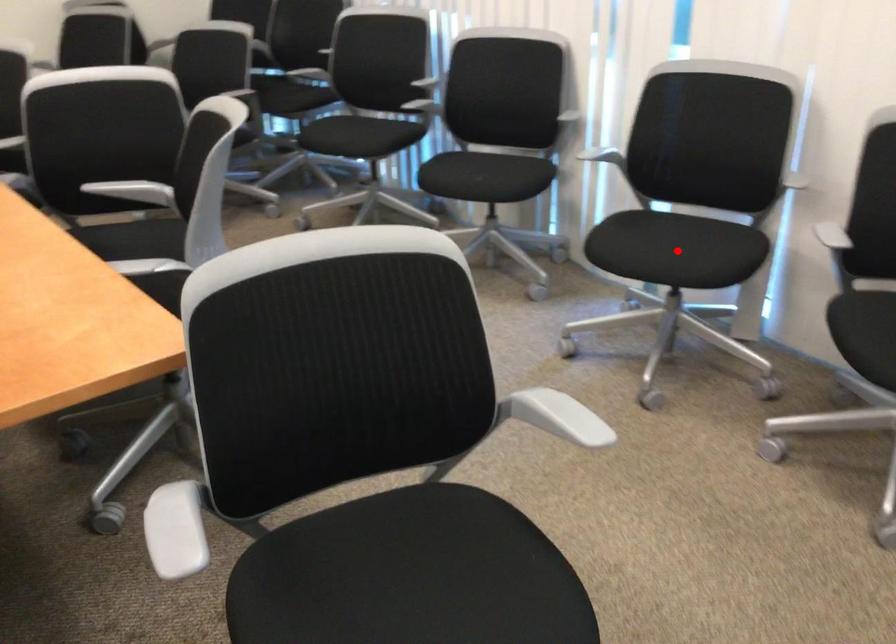
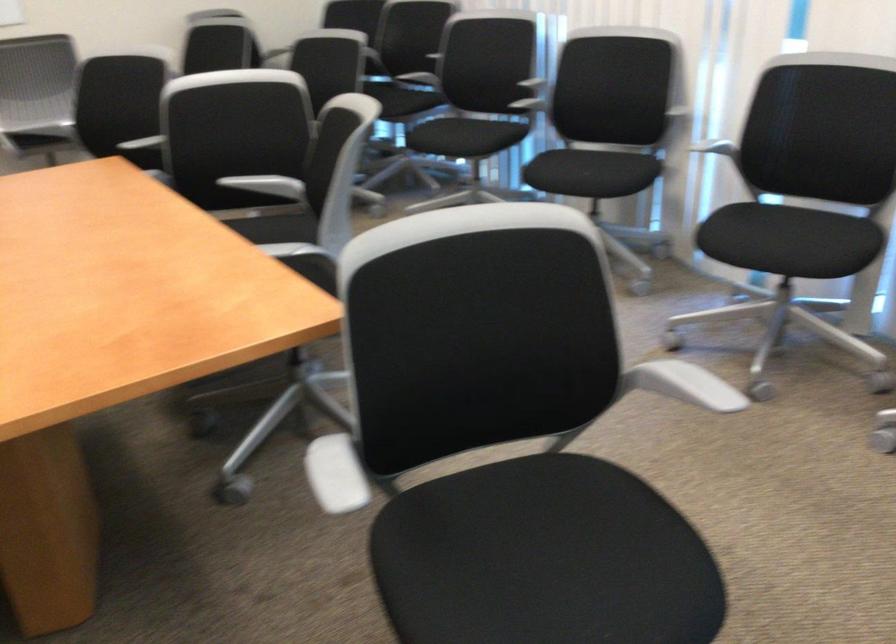
In the second image, find the point that corresponds to the highlighted location in the first image.

(789, 240)